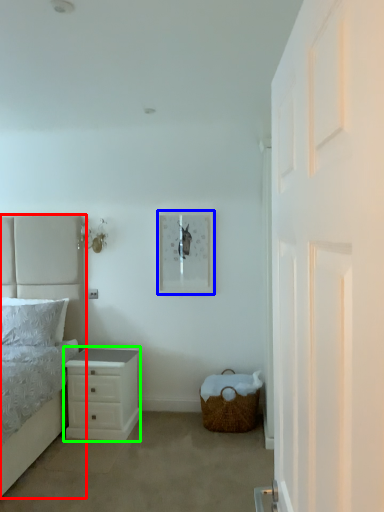
Question: Based on their relative distances, which object is nearer to bed (highlighted by a red box)? Choose from picture frame (highlighted by a blue box) and chest of drawers (highlighted by a green box).

Choices:
 (A) picture frame
 (B) chest of drawers

Answer: (B)